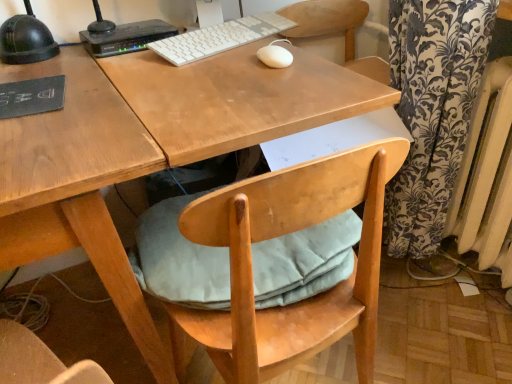
At what (x,y) coordinates should I click in order to perform the action: click on empty space that is to the right of white matte mouse at center. Please return your answer as a coordinate pair (x, y). This screenshot has height=384, width=512. Looking at the image, I should click on (314, 60).